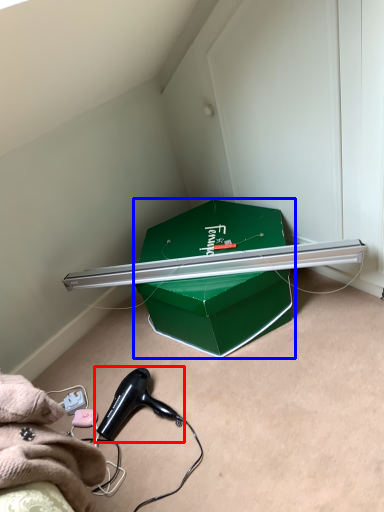
Question: Which object is closer to the camera taking this photo, hair drier (highlighted by a red box) or box (highlighted by a blue box)?

Choices:
 (A) hair drier
 (B) box

Answer: (A)